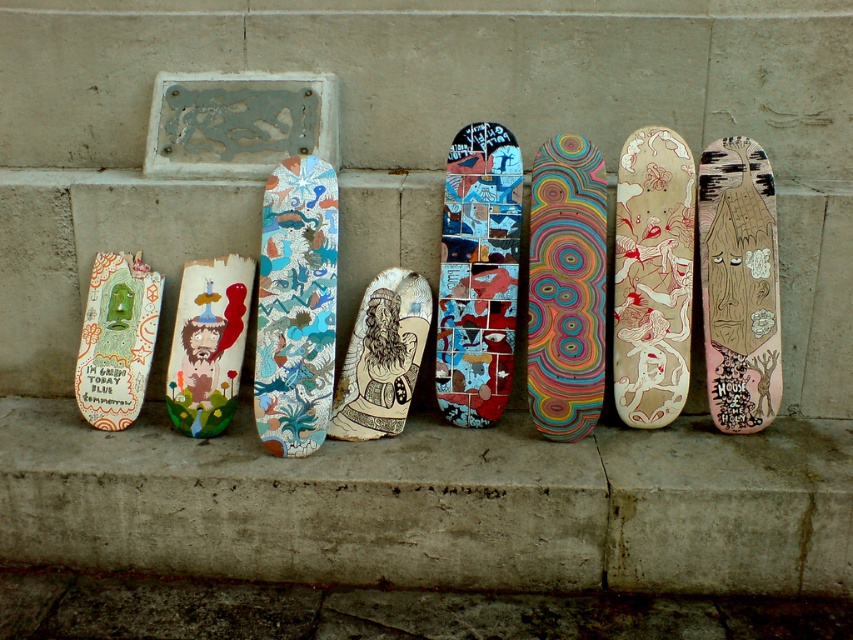
Is point (645, 161) positioned after point (257, 397)?

Yes, point (645, 161) is behind point (257, 397).

Can you confirm if beige wood skateboard at center is positioned to the right of shiny metallic skateboard at center?

Correct, you'll find beige wood skateboard at center to the right of shiny metallic skateboard at center.

Describe the element at coordinates (653, 276) in the screenshot. I see `beige wood skateboard at center` at that location.

Find the location of `beige wood skateboard at center`. beige wood skateboard at center is located at coordinates (653, 276).

Can you confirm if multicolored mosaic skateboard at center is positioned to the right of beige wood skateboard at center?

In fact, multicolored mosaic skateboard at center is to the left of beige wood skateboard at center.

Between point (503, 230) and point (668, 173), which one is positioned behind?

Point (503, 230)

You are a GUI agent. You are given a task and a screenshot of the screen. Output one action in this format:
    pyautogui.click(x=<x>, y=<y>)
    Task: Click on the multicolored mosaic skateboard at center
    This screenshot has width=853, height=640.
    Given the screenshot: What is the action you would take?
    pyautogui.click(x=479, y=275)

This screenshot has width=853, height=640. Describe the element at coordinates (740, 284) in the screenshot. I see `pink wood skateboard at right` at that location.

Which is in front, point (750, 371) or point (219, 420)?

Point (219, 420) is in front.

What do you see at coordinates (740, 284) in the screenshot? The width and height of the screenshot is (853, 640). I see `pink wood skateboard at right` at bounding box center [740, 284].

Image resolution: width=853 pixels, height=640 pixels. I want to click on pink wood skateboard at right, so click(x=740, y=284).